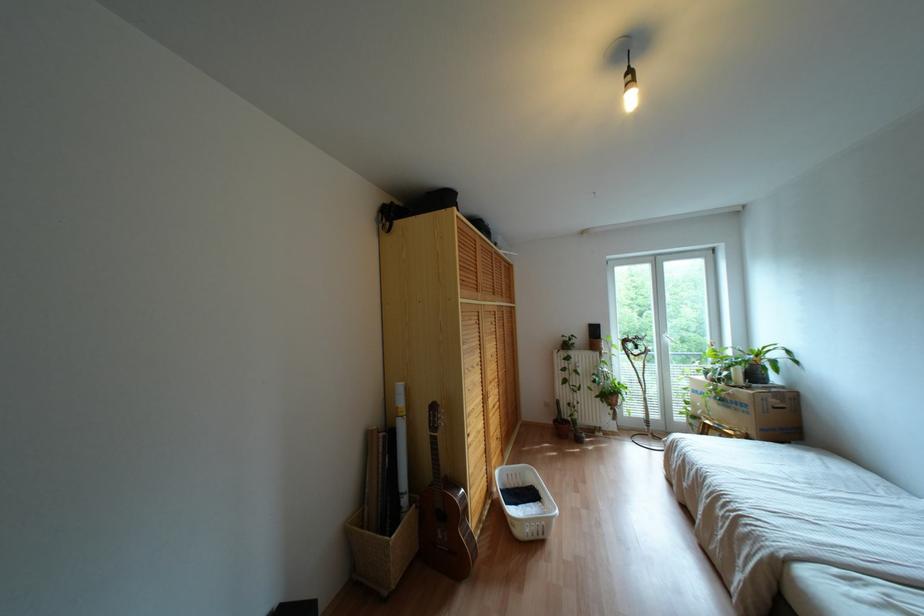
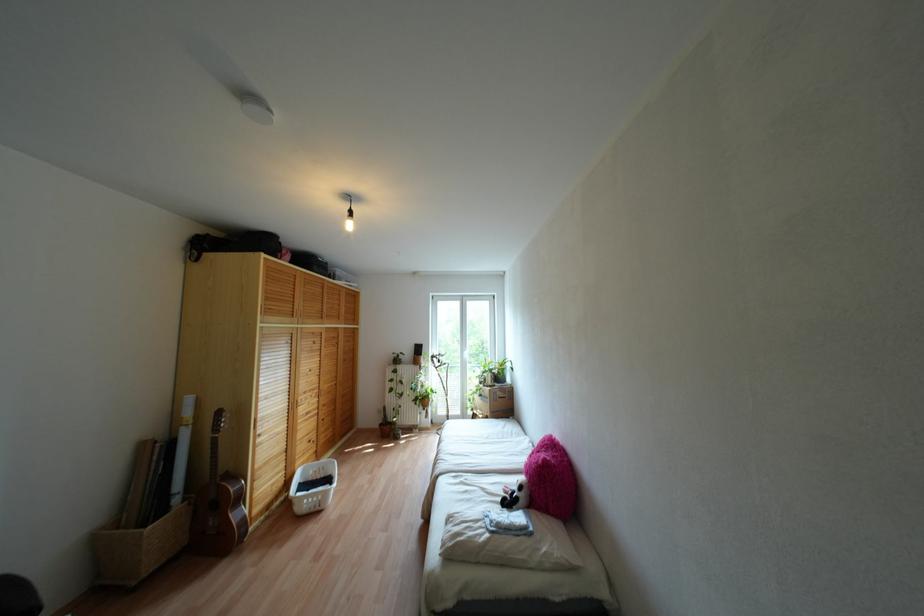
Where in the second image is the point corresponding to pixel 499 374 from the first image?

(324, 387)